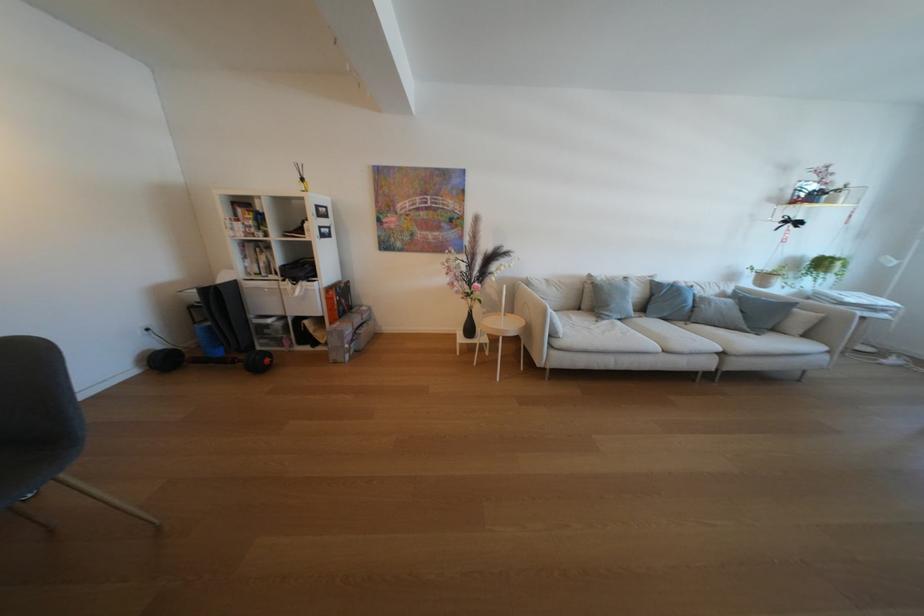
Locate an element on the screen. The image size is (924, 616). black barbell is located at coordinates (208, 360).